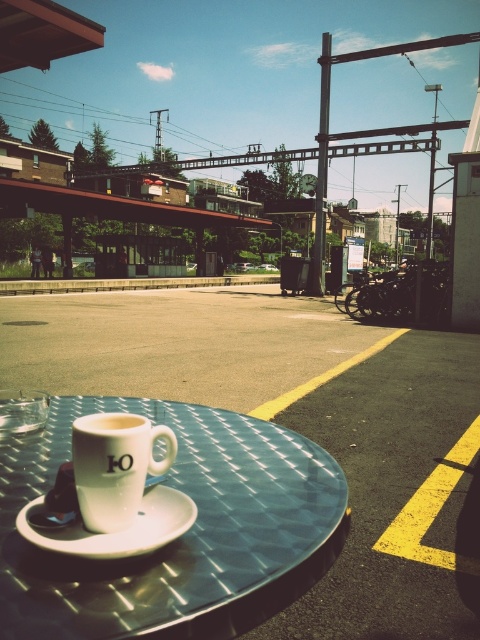
Question: Can you confirm if metallic textured table at center is bigger than white ceramic saucer at center?

Choices:
 (A) yes
 (B) no

Answer: (A)

Question: Which object appears closest to the camera in this image?

Choices:
 (A) white matte mug at center
 (B) metallic textured table at center
 (C) white ceramic saucer at center

Answer: (B)

Question: Can you confirm if white matte mug at center is bigger than white ceramic saucer at center?

Choices:
 (A) yes
 (B) no

Answer: (A)

Question: Does metallic textured table at center lie behind white matte mug at center?

Choices:
 (A) yes
 (B) no

Answer: (B)

Question: Which point is closer to the camera?

Choices:
 (A) white ceramic saucer at center
 (B) white matte mug at center
 (C) metallic textured table at center

Answer: (C)

Question: Which object is positioned closest to the white matte mug at center?

Choices:
 (A) metallic textured table at center
 (B) white ceramic saucer at center

Answer: (B)